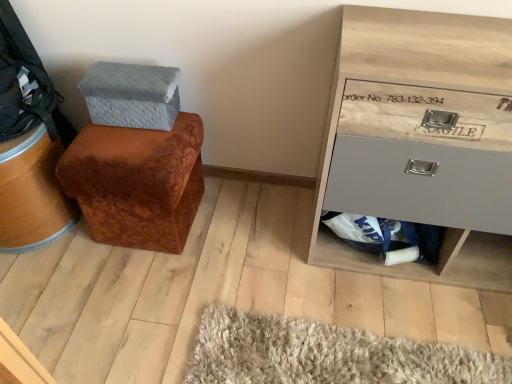
Question: Considering their positions, is brown velvety ottoman at left located in front of or behind wooden drawer at right?

Choices:
 (A) behind
 (B) front

Answer: (A)

Question: Is brown velvety ottoman at left taller or shorter than wooden drawer at right?

Choices:
 (A) tall
 (B) short

Answer: (B)

Question: Which object is the closest to the wooden drawer at right?

Choices:
 (A) brown velvety ottoman at left
 (B) textured gray shoe box at upper left

Answer: (A)

Question: Which is nearer to the wooden drawer at right?

Choices:
 (A) textured gray shoe box at upper left
 (B) brown velvety ottoman at left

Answer: (B)